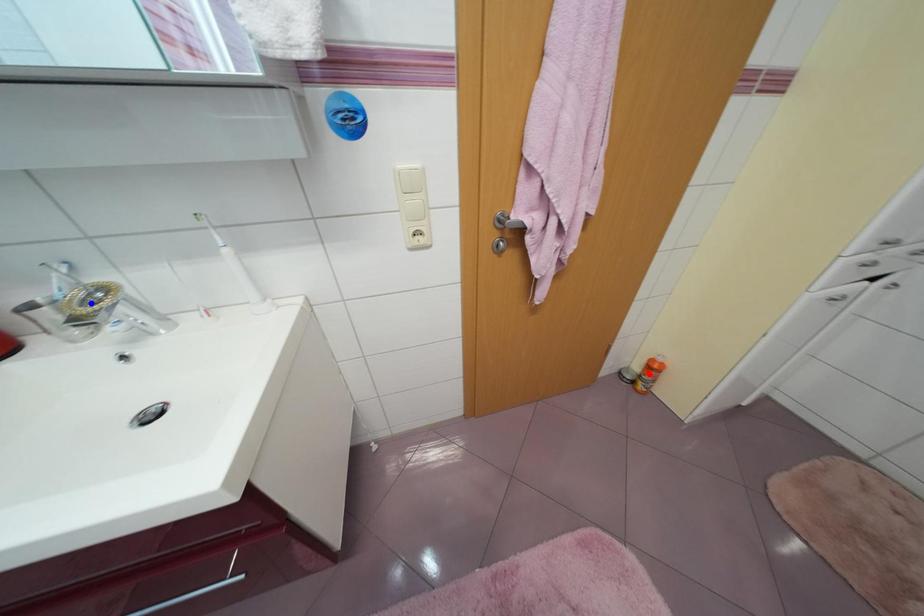
Question: Which of the two points in the image is closer to the camera?

Choices:
 (A) Blue point is closer.
 (B) Red point is closer.

Answer: (A)